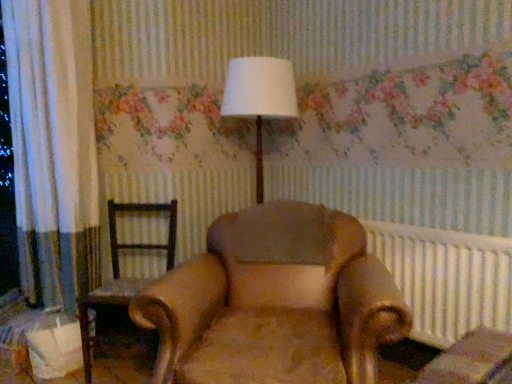
This screenshot has width=512, height=384. What are the coordinates of `brown leather chair at left, positioned as the 1th chair in left-to-right order` in the screenshot? It's located at (119, 269).

Locate an element on the screen. The height and width of the screenshot is (384, 512). white fabric lampshade at center is located at coordinates (259, 98).

Where is `white plastic radiator at right`? white plastic radiator at right is located at coordinates (446, 278).

I want to click on brown leather chair at left, placed as the second chair when sorted from right to left, so click(119, 269).

Could you tell me if leather armchair at center, the second chair viewed from the left, is facing white fabric lampshade at center?

No, leather armchair at center, the second chair viewed from the left, is not facing towards white fabric lampshade at center.

Is white fabric lampshade at center surrounded by leather armchair at center, the second chair viewed from the left?

No, white fabric lampshade at center is not a part of leather armchair at center, the second chair viewed from the left.

From a real-world perspective, does leather armchair at center, the second chair viewed from the left, stand above white fabric lampshade at center?

No, from a real-world perspective, leather armchair at center, the second chair viewed from the left, is not on top of white fabric lampshade at center.

Based on the photo, which object is further away from the camera, leather armchair at center, the second chair viewed from the left, or white fabric lampshade at center?

white fabric lampshade at center is further from the camera.

Which object is further away from the camera taking this photo, white fabric lampshade at center or leather armchair at center, the second chair viewed from the left?

Positioned behind is white fabric lampshade at center.

Could you measure the distance between white fabric lampshade at center and leather armchair at center, the first chair when ordered from right to left?

30.50 inches.

In terms of size, does white fabric lampshade at center appear bigger or smaller than leather armchair at center, the second chair viewed from the left?

Considering their sizes, white fabric lampshade at center takes up less space than leather armchair at center, the second chair viewed from the left.

From the image's perspective, relative to leather armchair at center, the first chair when ordered from right to left, is white fabric lampshade at center above or below?

Based on their image positions, white fabric lampshade at center is located above leather armchair at center, the first chair when ordered from right to left.

Visually, is white plastic radiator at right positioned to the left or to the right of white fabric lampshade at center?

Based on their positions, white plastic radiator at right is located to the right of white fabric lampshade at center.

Considering the sizes of objects white plastic radiator at right and white fabric lampshade at center in the image provided, who is smaller, white plastic radiator at right or white fabric lampshade at center?

white plastic radiator at right.

Where is `radiator that is in front of the white fabric lampshade at center`? Image resolution: width=512 pixels, height=384 pixels. radiator that is in front of the white fabric lampshade at center is located at coordinates (446, 278).

Looking at this image, is white plastic radiator at right far away from white fabric lampshade at center?

No, white plastic radiator at right is not far away from white fabric lampshade at center.

Could you tell me if brown leather chair at left, positioned as the 1th chair in left-to-right order, is turned towards leather armchair at center, the second chair viewed from the left?

No, brown leather chair at left, positioned as the 1th chair in left-to-right order, does not turn towards leather armchair at center, the second chair viewed from the left.

Which is behind, brown leather chair at left, placed as the second chair when sorted from right to left, or leather armchair at center, the second chair viewed from the left?

brown leather chair at left, placed as the second chair when sorted from right to left, is further from the camera.

From a real-world perspective, which is physically below, brown leather chair at left, placed as the second chair when sorted from right to left, or leather armchair at center, the first chair when ordered from right to left?

brown leather chair at left, placed as the second chair when sorted from right to left, from a real-world perspective.

From the image's perspective, is brown leather chair at left, positioned as the 1th chair in left-to-right order, beneath leather armchair at center, the first chair when ordered from right to left?

No, from the image's perspective, brown leather chair at left, positioned as the 1th chair in left-to-right order, is not below leather armchair at center, the first chair when ordered from right to left.

Is white plastic radiator at right oriented towards brown leather chair at left, positioned as the 1th chair in left-to-right order?

No, white plastic radiator at right is not facing towards brown leather chair at left, positioned as the 1th chair in left-to-right order.

Image resolution: width=512 pixels, height=384 pixels. In order to click on radiator to the right of brown leather chair at left, placed as the second chair when sorted from right to left in this screenshot , I will do `click(446, 278)`.

Does white plastic radiator at right have a larger size compared to brown leather chair at left, positioned as the 1th chair in left-to-right order?

No.

Based on the photo, would you say white plastic radiator at right contains brown leather chair at left, positioned as the 1th chair in left-to-right order?

No, white plastic radiator at right does not contain brown leather chair at left, positioned as the 1th chair in left-to-right order.

Considering the relative positions of white plastic radiator at right and leather armchair at center, the first chair when ordered from right to left, in the image provided, is white plastic radiator at right to the right of leather armchair at center, the first chair when ordered from right to left, from the viewer's perspective?

Correct, you'll find white plastic radiator at right to the right of leather armchair at center, the first chair when ordered from right to left.

From the white plastic radiator at right, count the 1st chair to the left and point to it. Please provide its 2D coordinates.

[(275, 303)]

From the picture: Does white plastic radiator at right turn towards leather armchair at center, the first chair when ordered from right to left?

Yes, white plastic radiator at right is aimed at leather armchair at center, the first chair when ordered from right to left.

From a real-world perspective, is white plastic radiator at right located beneath leather armchair at center, the first chair when ordered from right to left?

No.

From the image's perspective, which one is positioned higher, brown leather chair at left, positioned as the 1th chair in left-to-right order, or white plastic radiator at right?

white plastic radiator at right is shown above in the image.

Looking at this image, can you confirm if brown leather chair at left, positioned as the 1th chair in left-to-right order, is wider than white plastic radiator at right?

Correct, the width of brown leather chair at left, positioned as the 1th chair in left-to-right order, exceeds that of white plastic radiator at right.

Between brown leather chair at left, positioned as the 1th chair in left-to-right order, and white plastic radiator at right, which one appears on the left side from the viewer's perspective?

brown leather chair at left, positioned as the 1th chair in left-to-right order.

Where is `chair that is the 2nd one when counting forward from the white fabric lampshade at center`? chair that is the 2nd one when counting forward from the white fabric lampshade at center is located at coordinates (275, 303).

Identify the location of lamp above the leather armchair at center, the second chair viewed from the left (from the image's perspective). (259, 98).

Looking at the image, which one is located further to brown leather chair at left, positioned as the 1th chair in left-to-right order, white fabric lampshade at center or leather armchair at center, the first chair when ordered from right to left?

white fabric lampshade at center.

When comparing their distances from white fabric lampshade at center, does white plastic radiator at right or brown leather chair at left, positioned as the 1th chair in left-to-right order, seem further?

white plastic radiator at right is positioned further to the anchor white fabric lampshade at center.

When comparing their distances from brown leather chair at left, positioned as the 1th chair in left-to-right order, does white fabric lampshade at center or white plastic radiator at right seem closer?

Among the two, white fabric lampshade at center is located nearer to brown leather chair at left, positioned as the 1th chair in left-to-right order.

Based on their spatial positions, is white fabric lampshade at center or brown leather chair at left, placed as the second chair when sorted from right to left, closer to leather armchair at center, the second chair viewed from the left?

brown leather chair at left, placed as the second chair when sorted from right to left, is closer to leather armchair at center, the second chair viewed from the left.

Estimate the real-world distances between objects in this image. Which object is further from white plastic radiator at right, white fabric lampshade at center or brown leather chair at left, positioned as the 1th chair in left-to-right order?

brown leather chair at left, positioned as the 1th chair in left-to-right order.

From the image, which object appears to be farther from white fabric lampshade at center, brown leather chair at left, positioned as the 1th chair in left-to-right order, or white plastic radiator at right?

white plastic radiator at right is further to white fabric lampshade at center.

Looking at the image, which one is located further to leather armchair at center, the second chair viewed from the left, white fabric lampshade at center or white plastic radiator at right?

white fabric lampshade at center is further to leather armchair at center, the second chair viewed from the left.

From the image, which object appears to be nearer to white plastic radiator at right, white fabric lampshade at center or leather armchair at center, the first chair when ordered from right to left?

Based on the image, leather armchair at center, the first chair when ordered from right to left, appears to be nearer to white plastic radiator at right.

I want to click on chair located between leather armchair at center, the first chair when ordered from right to left, and white fabric lampshade at center in the depth direction, so click(119, 269).

This screenshot has height=384, width=512. I want to click on chair located between brown leather chair at left, positioned as the 1th chair in left-to-right order, and white plastic radiator at right in the left-right direction, so click(275, 303).

This screenshot has width=512, height=384. I want to click on lamp situated between brown leather chair at left, placed as the second chair when sorted from right to left, and white plastic radiator at right from left to right, so [259, 98].

Find the location of a particular element. radiator positioned between leather armchair at center, the first chair when ordered from right to left, and white fabric lampshade at center from near to far is located at coordinates (446, 278).